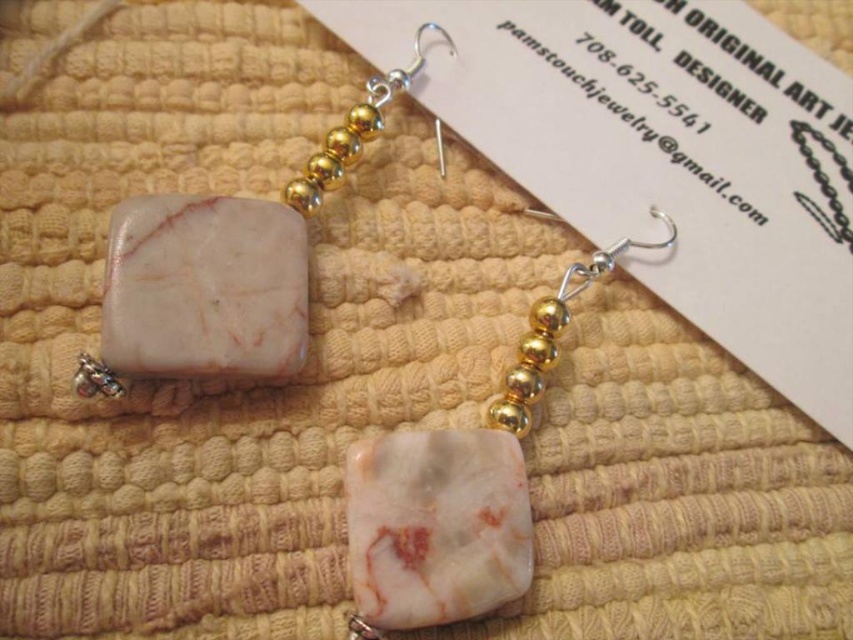
Question: Does white marble stone at upper left have a smaller size compared to white marble stone at center?

Choices:
 (A) yes
 (B) no

Answer: (B)

Question: Does white marble stone at upper left appear on the left side of white marble stone at center?

Choices:
 (A) no
 (B) yes

Answer: (B)

Question: Does white marble stone at upper left appear over white marble stone at center?

Choices:
 (A) no
 (B) yes

Answer: (B)

Question: Among these points, which one is nearest to the camera?

Choices:
 (A) (370, 593)
 (B) (234, 364)

Answer: (A)